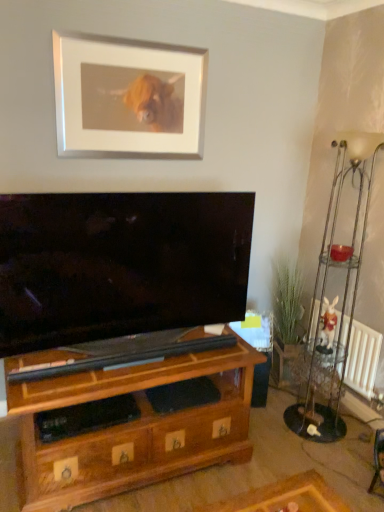
The height and width of the screenshot is (512, 384). What are the coordinates of `free spot in front of metallic silver side table at right` in the screenshot? It's located at point(312,440).